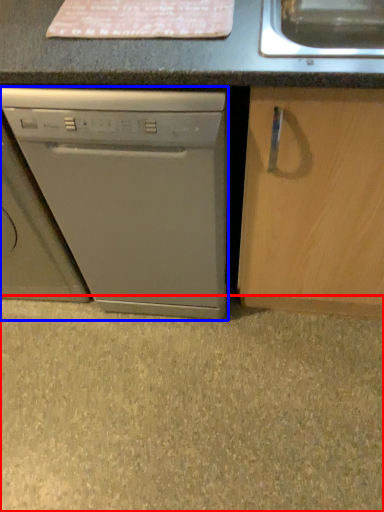
Question: Which point is closer to the camera, concrete (highlighted by a red box) or washing machine (highlighted by a blue box)?

Choices:
 (A) concrete
 (B) washing machine

Answer: (B)